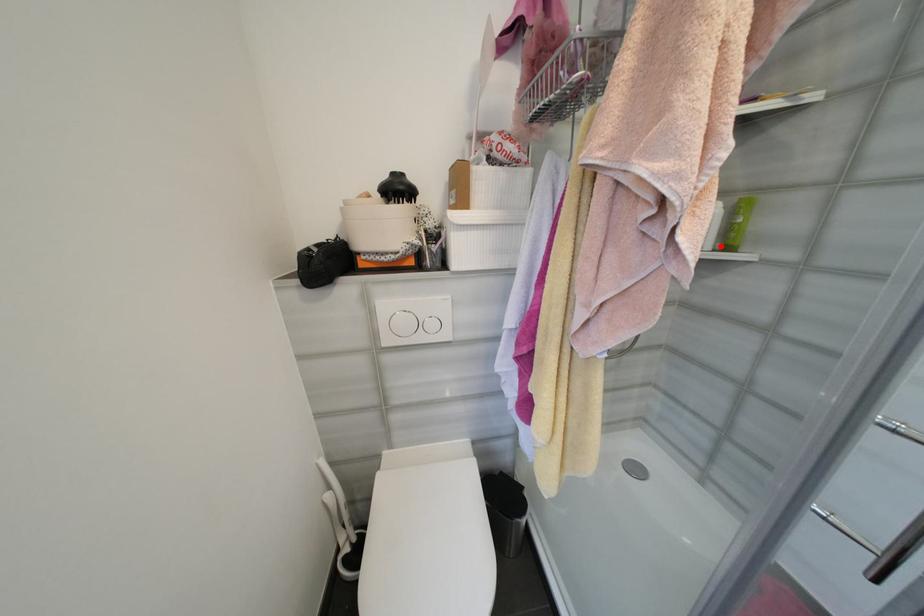
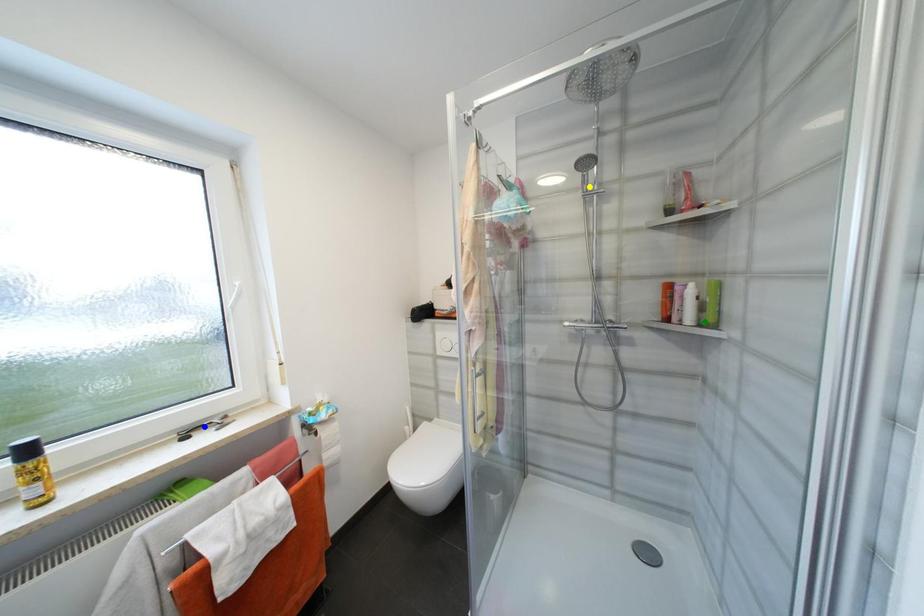
Question: I am providing you with two images of the same scene from different viewpoints. A red point is marked on the first image. You are given multiple points on the second image. In image 2, which mark is for the same physical point as the one in image 1?

Choices:
 (A) green point
 (B) yellow point
 (C) blue point

Answer: (A)